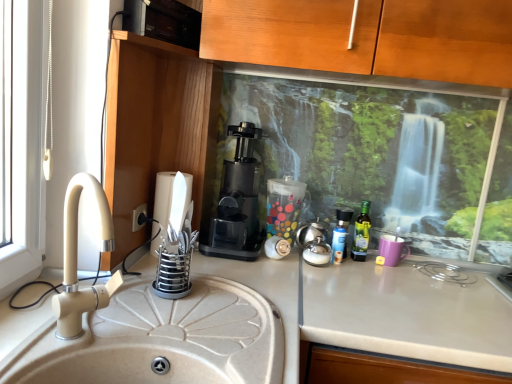
Locate an element on the screen. vacant space to the right of green glass bottle at right, the first bottle in the right-to-left sequence is located at coordinates (418, 272).